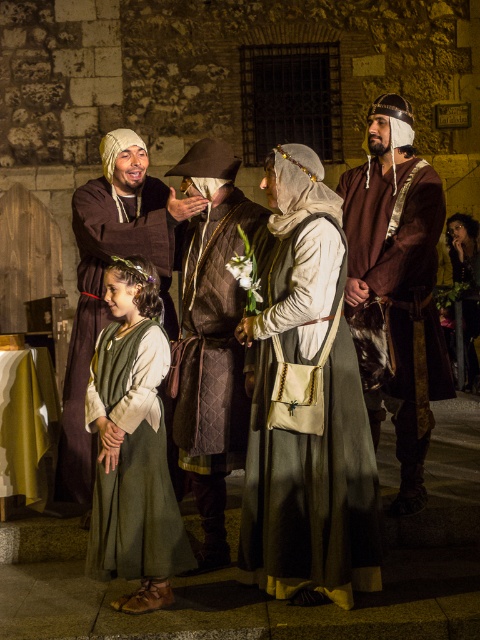
Which is above, matte gray robe at center or brown quilted tunic at center?

brown quilted tunic at center

Is matte gray robe at center wider than brown quilted tunic at center?

Yes.

Is point (326, 323) closer to camera compared to point (217, 243)?

Yes, point (326, 323) is closer to viewer.

You are a GUI agent. You are given a task and a screenshot of the screen. Output one action in this format:
    pyautogui.click(x=<x>, y=<y>)
    Task: Click on the matte gray robe at center
    The image size is (480, 640).
    Given the screenshot: What is the action you would take?
    pyautogui.click(x=305, y=404)

Can you confirm if brown leather armor at right is bigger than brown quilted tunic at center?

No, brown leather armor at right is not bigger than brown quilted tunic at center.

Is brown leather armor at right thinner than brown quilted tunic at center?

No, brown leather armor at right is not thinner than brown quilted tunic at center.

Identify the location of brown leather armor at right. (397, 284).

Who is more distant from viewer, (143, 493) or (93, 477)?

The point (93, 477) is more distant.

Which is more to the left, green fabric dress at center or brown leather hat at center?

brown leather hat at center is more to the left.

The image size is (480, 640). Describe the element at coordinates (132, 445) in the screenshot. I see `green fabric dress at center` at that location.

This screenshot has width=480, height=640. What are the coordinates of `green fabric dress at center` in the screenshot? It's located at (132, 445).